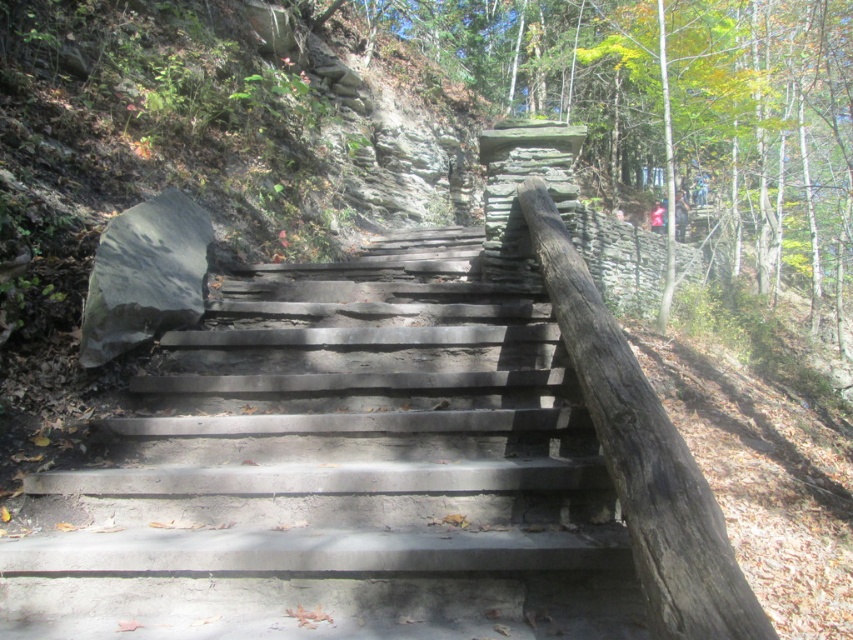
Question: Which of the following is the closest to the observer?

Choices:
 (A) (630, 378)
 (B) (227, 636)

Answer: (A)

Question: Which object appears closest to the camera in this image?

Choices:
 (A) gray concrete stairs at center
 (B) smooth brown log at right

Answer: (B)

Question: Is gray concrete stairs at center thinner than smooth brown log at right?

Choices:
 (A) no
 (B) yes

Answer: (A)

Question: Does gray concrete stairs at center have a greater width compared to smooth brown log at right?

Choices:
 (A) yes
 (B) no

Answer: (A)

Question: Can you confirm if gray concrete stairs at center is bigger than smooth brown log at right?

Choices:
 (A) no
 (B) yes

Answer: (B)